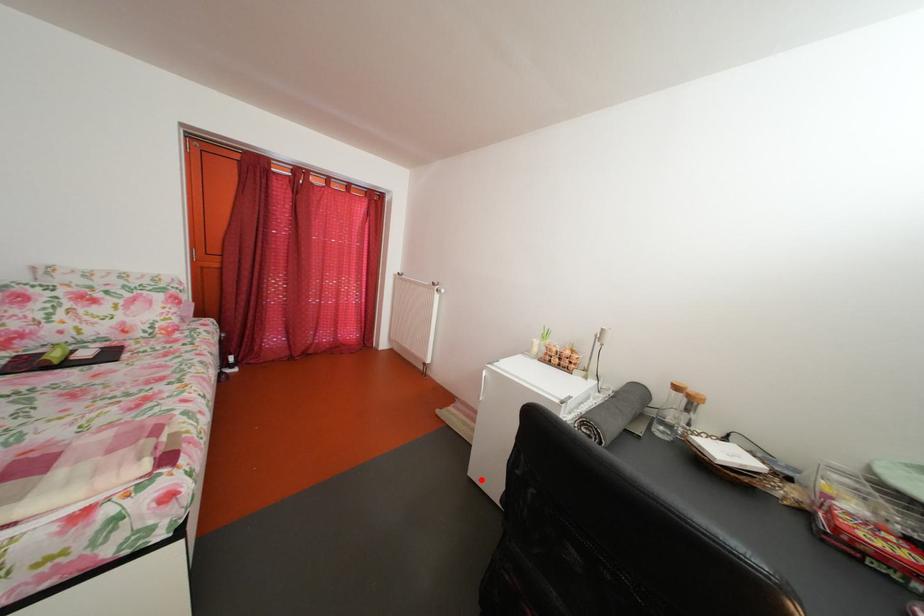
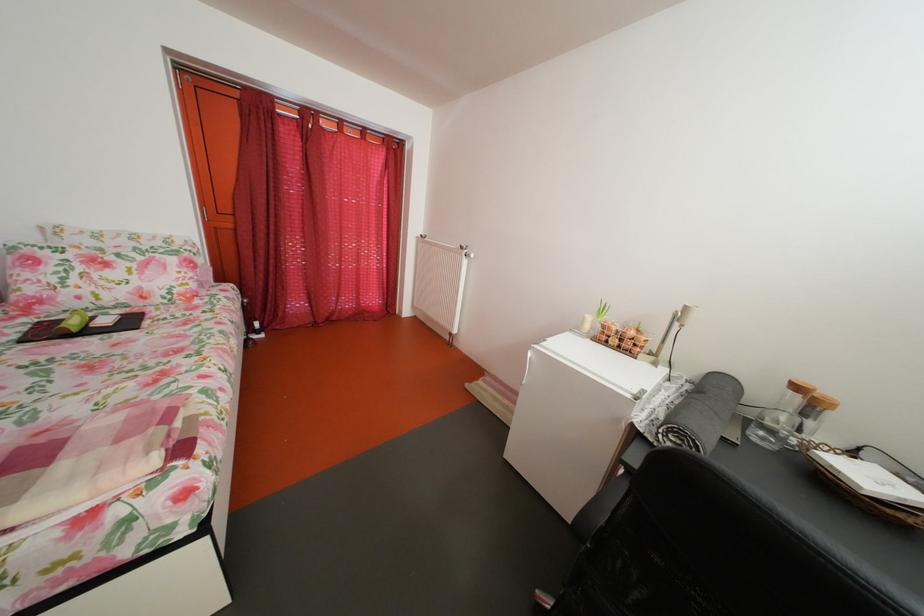
Question: I am providing you with two images of the same scene from different viewpoints. In image1, a red point is highlighted. Considering the same 3D point in image2, which of the following is correct?

Choices:
 (A) It is closer
 (B) It is farther

Answer: (A)